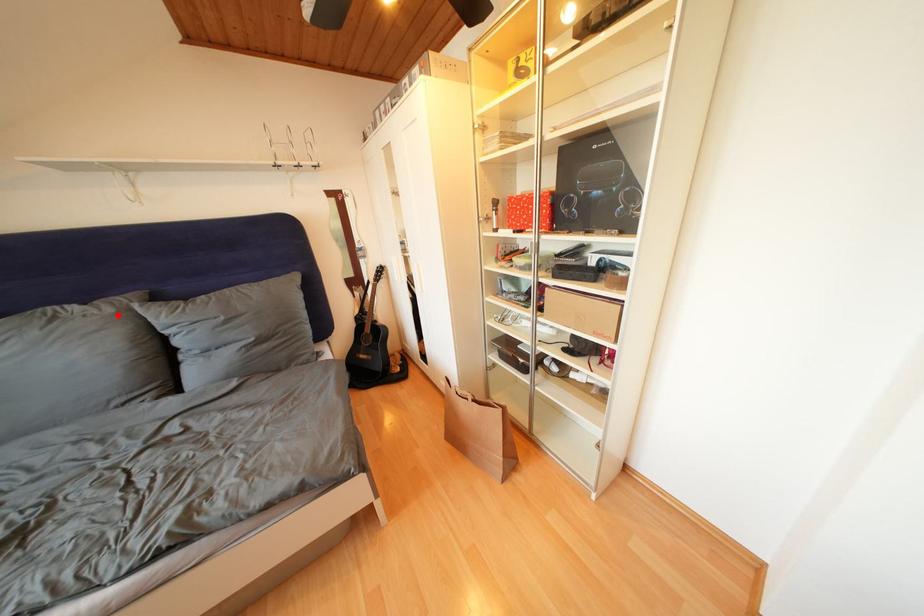
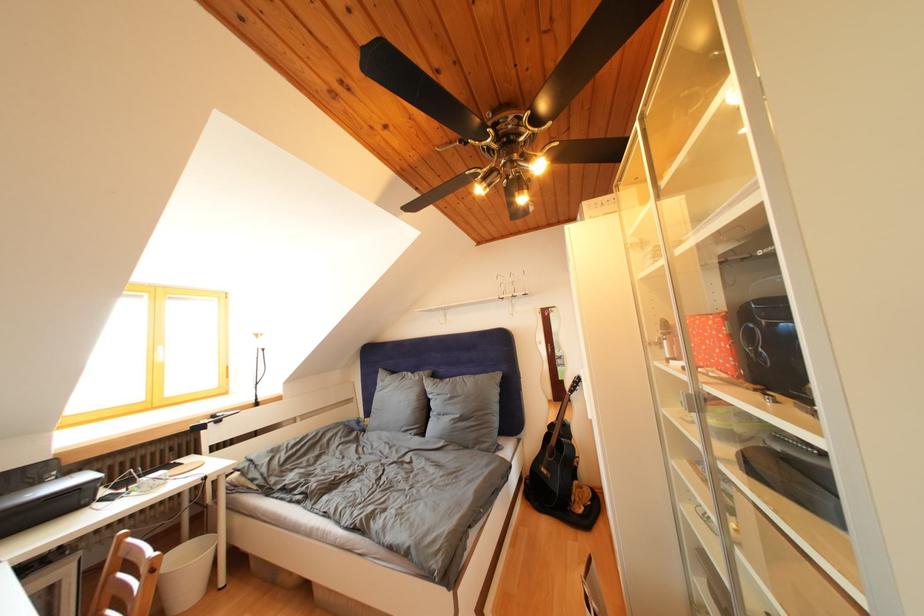
Where in the second image is the point corresponding to the highlighted location from the first image?

(426, 383)